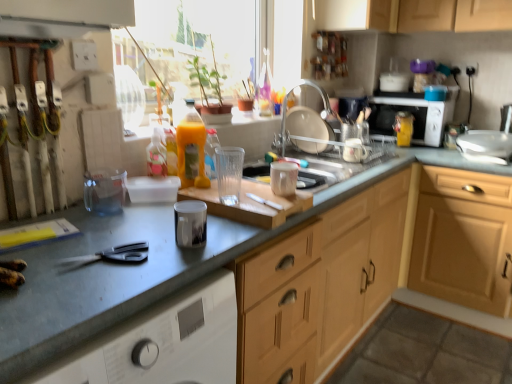
At what (x,y) coordinates should I click in order to perform the action: click on free location in front of shiny metallic cup at center, which appears as the 6th appliance when viewed from the top. Please return your answer as a coordinate pair (x, y). Looking at the image, I should click on (156, 266).